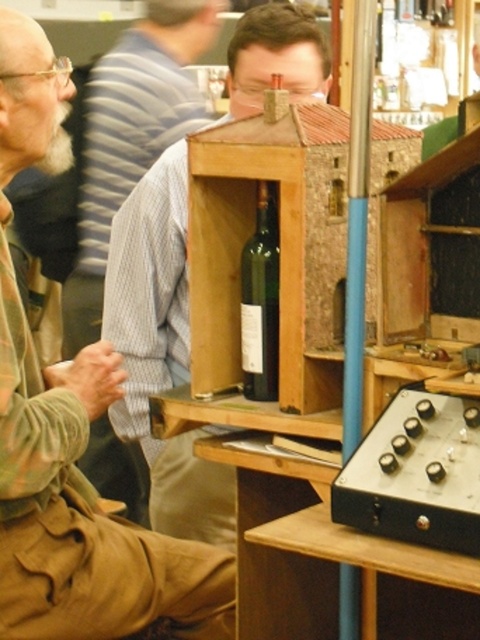
You are standing in front of the wooden structure with the dark green wine bottle. You notice two points marked in the scene. One is at coordinates point (275, 273) and the other at point (63, 163). Which point is closer to you?

Point (63, 163) is closer to you because point (275, 273) is behind it.

Consider the image. You are a technician who needs to place a 12 inch long tool between the light brown wood at center and the green glass bottle at center. Can you fit it there?

The distance between the light brown wood at center and the green glass bottle at center is 16.56 inches, so yes, the 12 inch long tool can fit between them since it is shorter than the available space.

You are standing in the exhibition area and notice two light brown items. One is the light brown wood at center, and the other is the light brown shirt at left. Which item is smaller in size?

The light brown wood at center is smaller than the light brown shirt at left.